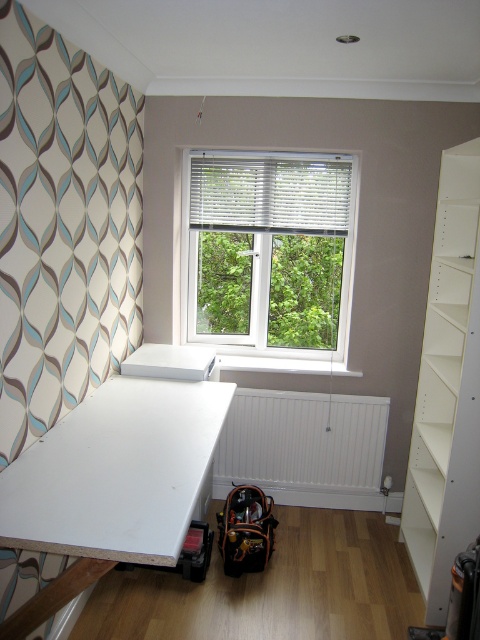
Between white plastic window at center and white matte radiator at lower center, which one is positioned lower?

white matte radiator at lower center

Can you confirm if white plastic window at center is thinner than white matte radiator at lower center?

Correct, white plastic window at center's width is less than white matte radiator at lower center's.

Where is `white plastic window at center`? white plastic window at center is located at coordinates (268, 252).

Where is `white plastic window at center`? white plastic window at center is located at coordinates (268, 252).

Does white matte bookshelf at right have a lesser height compared to white matte radiator at lower center?

In fact, white matte bookshelf at right may be taller than white matte radiator at lower center.

Is point (478, 212) positioned after point (280, 432)?

No, it is in front of (280, 432).

Identify the location of white matte bookshelf at right. The width and height of the screenshot is (480, 640). (446, 390).

Is white plastic window at center positioned behind white matte bookshelf at right?

Yes.

Is point (315, 316) positioned in front of point (470, 404)?

No, it is behind (470, 404).

You are a GUI agent. You are given a task and a screenshot of the screen. Output one action in this format:
    pyautogui.click(x=<x>, y=<y>)
    Task: Click on the white plastic window at center
    The height and width of the screenshot is (640, 480).
    Given the screenshot: What is the action you would take?
    pyautogui.click(x=268, y=252)